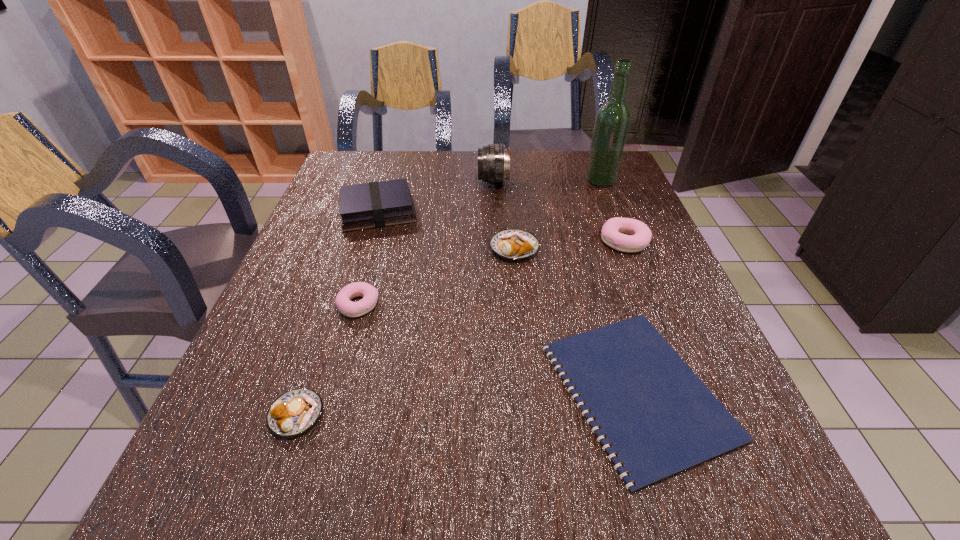
This screenshot has width=960, height=540. Find the location of `vacant region between the telephoto lens and the smaller brown pastry`. vacant region between the telephoto lens and the smaller brown pastry is located at coordinates (395, 298).

Identify the location of object that ranks as the second closest to the seventh shortest object. (515, 244).

Identify which object is the sixth nearest to the nearer pink pastry. Please provide its 2D coordinates. Your answer should be formatted as a tuple, i.e. [(x, y)], where the tuple contains the x and y coordinates of a point satisfying the conditions above.

[(639, 237)]

At what (x,y) coordinates should I click in order to perform the action: click on pastry that is the second closest to the seventh shortest object. Please return your answer as a coordinate pair (x, y). This screenshot has width=960, height=540. Looking at the image, I should click on (639, 237).

The height and width of the screenshot is (540, 960). Find the location of `the closest pastry relative to the third tallest object`. the closest pastry relative to the third tallest object is located at coordinates (515, 244).

Locate an element on the screen. This screenshot has width=960, height=540. vacant space that satisfies the following two spatial constraints: 1. on the front side of the smaller pink pastry; 2. on the right side of the sixth shortest object is located at coordinates (349, 305).

Find the location of a particular element. The image size is (960, 540). vacant point that satisfies the following two spatial constraints: 1. on the back side of the shortest object; 2. at the front element of the second tallest object is located at coordinates (573, 181).

The height and width of the screenshot is (540, 960). What are the coordinates of `free space that satisfies the following two spatial constraints: 1. on the back side of the liquor; 2. on the left side of the third tallest object` in the screenshot? It's located at (387, 180).

At what (x,y) coordinates should I click in order to perform the action: click on vacant space that satisfies the following two spatial constraints: 1. at the front element of the seventh shortest object; 2. on the right side of the right pink pastry. Please return your answer as a coordinate pair (x, y). Looking at the image, I should click on (495, 241).

Where is `vacant region that satisfies the following two spatial constraints: 1. at the front element of the second tallest object; 2. on the front side of the left pink pastry`? The height and width of the screenshot is (540, 960). vacant region that satisfies the following two spatial constraints: 1. at the front element of the second tallest object; 2. on the front side of the left pink pastry is located at coordinates (498, 305).